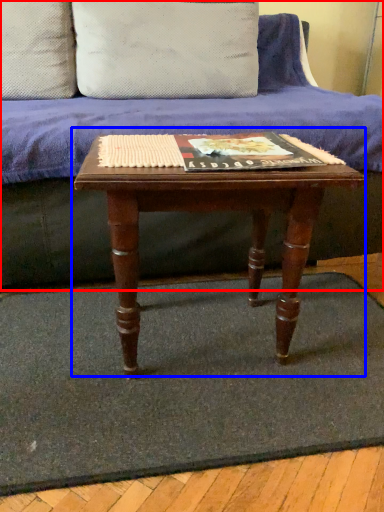
Question: Which of the following is the closest to the observer, studio couch (highlighted by a red box) or table (highlighted by a blue box)?

Choices:
 (A) studio couch
 (B) table

Answer: (B)